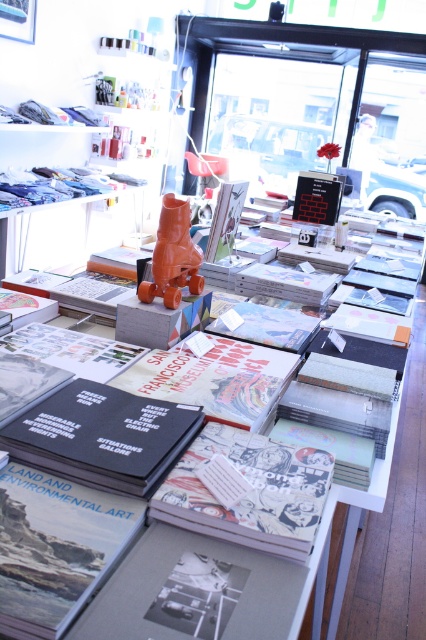
You are a delivery person who needs to place a small package between the matte black book at center and the orange matte sculpture at center. The package is 12 inches long. Can it fit between them without overlapping either object?

The distance between the matte black book at center and the orange matte sculpture at center is 31.13 inches. Since the package is only 12 inches long, it can easily fit between them without overlapping either object.